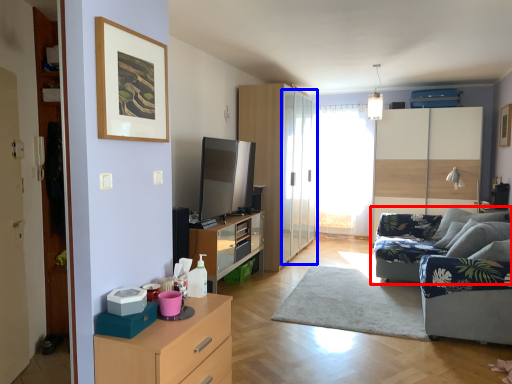
Question: Which object is closer to the camera taking this photo, studio couch (highlighted by a red box) or glass door (highlighted by a blue box)?

Choices:
 (A) studio couch
 (B) glass door

Answer: (A)